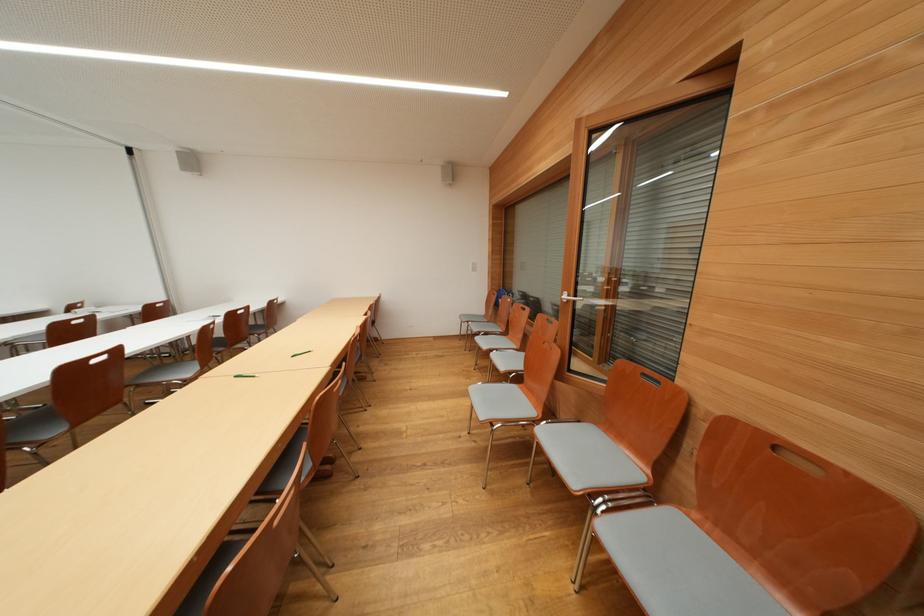
Describe the element at coordinates (759, 533) in the screenshot. The image size is (924, 616). I see `the chair back handle` at that location.